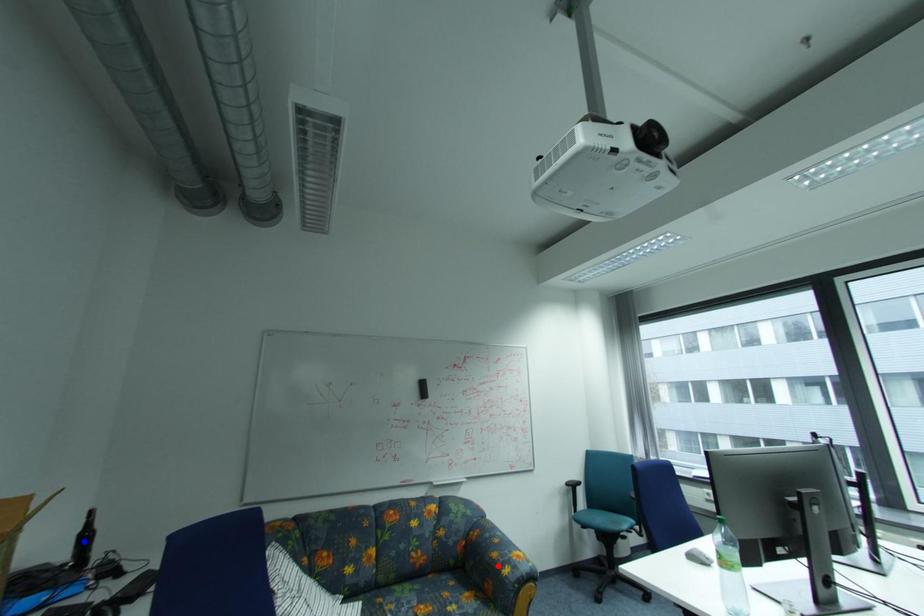
Question: Which of the two points in the image is closer to the camera?

Choices:
 (A) Blue point is closer.
 (B) Red point is closer.

Answer: (A)